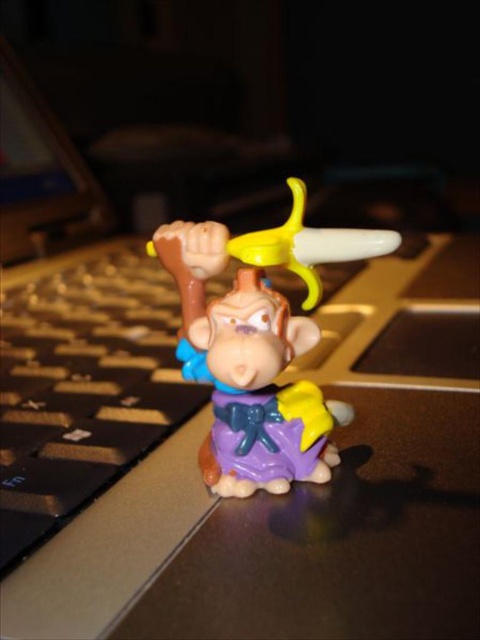
Question: Where is black plastic keyboard at left located in relation to matte plastic monkey at center in the image?

Choices:
 (A) below
 (B) above

Answer: (A)

Question: Can you confirm if black plastic keyboard at left is smaller than matte plastic monkey at center?

Choices:
 (A) no
 (B) yes

Answer: (A)

Question: Among these objects, which one is nearest to the camera?

Choices:
 (A) black plastic keyboard at left
 (B) matte plastic monkey at center

Answer: (A)

Question: From the image, what is the correct spatial relationship of black plastic keyboard at left in relation to matte plastic monkey at center?

Choices:
 (A) left
 (B) right

Answer: (A)

Question: Which object is farther from the camera taking this photo?

Choices:
 (A) black plastic keyboard at left
 (B) matte plastic monkey at center

Answer: (B)